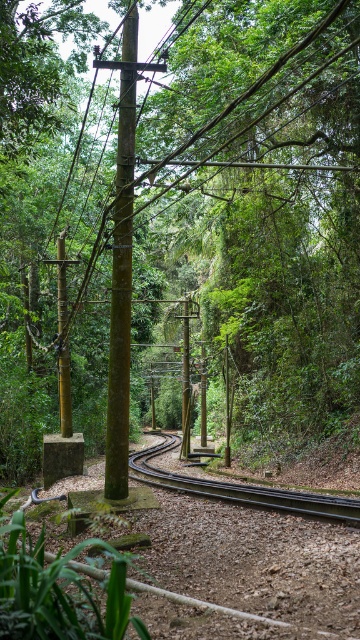
Question: Which point appears farthest from the camera in this image?

Choices:
 (A) (64, 282)
 (B) (185, 364)

Answer: (B)

Question: Can you confirm if brown wooden telegraph pole at center is thinner than green bamboo pole at center?

Choices:
 (A) yes
 (B) no

Answer: (A)

Question: Does brown wooden telegraph pole at center have a larger size compared to black metal train track at center?

Choices:
 (A) yes
 (B) no

Answer: (B)

Question: Which point is farther from the camera taking this photo?

Choices:
 (A) (183, 435)
 (B) (120, 449)
 (C) (262, 506)

Answer: (A)

Question: Which point is farther to the camera?

Choices:
 (A) green bamboo pole at center
 (B) brown wooden telegraph pole at center

Answer: (A)

Question: Is black metal train track at center to the right of green mossy pole at center from the viewer's perspective?

Choices:
 (A) yes
 (B) no

Answer: (A)